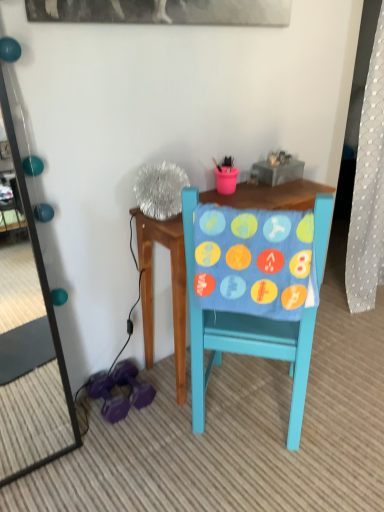
The width and height of the screenshot is (384, 512). I want to click on free space on the front side of matte blue chair at center, so click(x=259, y=481).